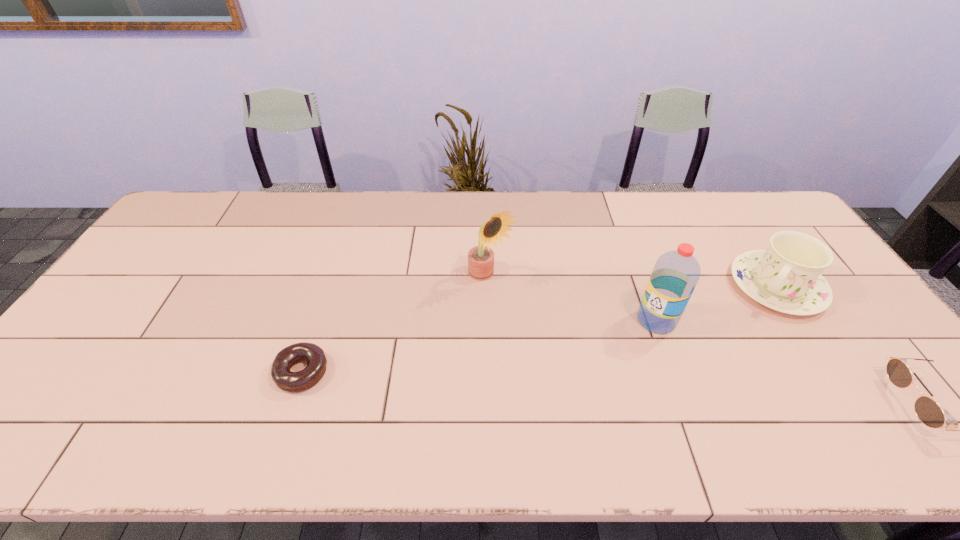
The width and height of the screenshot is (960, 540). I want to click on vacant space located 0.240m on the face of the sunflower, so click(x=564, y=345).

This screenshot has width=960, height=540. I want to click on vacant space located 0.320m on the face of the sunflower, so click(x=588, y=366).

You are a GUI agent. You are given a task and a screenshot of the screen. Output one action in this format:
    pyautogui.click(x=<x>, y=<y>)
    Task: Click on the blank space located 0.150m on the front label of the third object from right to left
    This screenshot has height=540, width=960.
    Given the screenshot: What is the action you would take?
    pyautogui.click(x=600, y=352)

Locate an element on the screen. The width and height of the screenshot is (960, 540). vacant position located on the front label of the third object from right to left is located at coordinates [x=538, y=388].

The width and height of the screenshot is (960, 540). I want to click on vacant space located 0.320m on the front label of the third object from right to left, so click(547, 382).

Find the location of `object that is at the near edge`. object that is at the near edge is located at coordinates (286, 380).

Where is `object that is at the right edge`? object that is at the right edge is located at coordinates (786, 277).

In the image, there is a desktop. At what (x,y) coordinates should I click in order to perform the action: click on vacant space at the far edge. Please return your answer as a coordinate pair (x, y). This screenshot has width=960, height=540. Looking at the image, I should click on (338, 206).

In the image, there is a desktop. Where is `vacant space at the near edge`? vacant space at the near edge is located at coordinates (332, 408).

The height and width of the screenshot is (540, 960). In order to click on vacant space at the right edge of the desktop in this screenshot , I will do `click(858, 353)`.